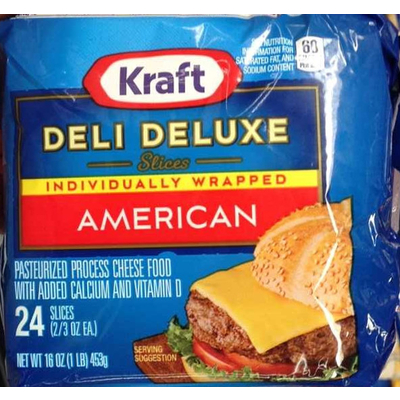
Identify the location of wooden serving tray. (166, 368).